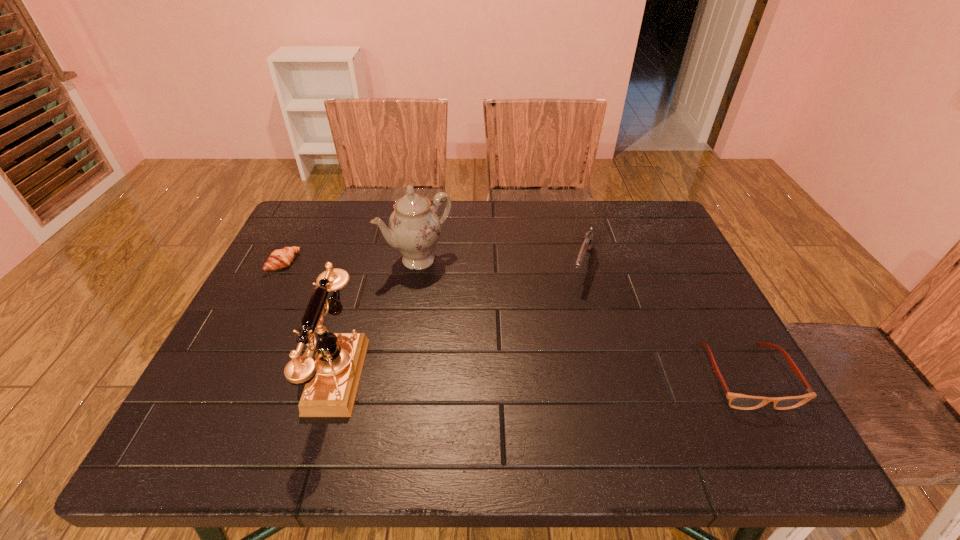
Where is `telephone`? The image size is (960, 540). telephone is located at coordinates pyautogui.click(x=331, y=379).

Where is `the rightmost object`? The image size is (960, 540). the rightmost object is located at coordinates (737, 401).

The height and width of the screenshot is (540, 960). I want to click on the second shortest object, so click(737, 401).

Where is `chinaware`? chinaware is located at coordinates (414, 228).

Locate an element on the screen. Image resolution: width=960 pixels, height=540 pixels. the shortest object is located at coordinates (280, 258).

Identify the location of pastry. (280, 258).

I want to click on the fourth object from left to right, so click(587, 244).

Image resolution: width=960 pixels, height=540 pixels. What are the coordinates of `the third tallest object` in the screenshot? It's located at (587, 244).

At what (x,y) coordinates should I click in order to perform the action: click on vacant space located on the dial of the telephone. Please return your answer as a coordinate pair (x, y). The height and width of the screenshot is (540, 960). Looking at the image, I should click on (233, 374).

You are a GUI agent. You are given a task and a screenshot of the screen. Output one action in this format:
    pyautogui.click(x=<x>, y=<y>)
    Task: Click on the free region located 0.130m on the dial of the telephone
    Image resolution: width=960 pixels, height=540 pixels.
    Given the screenshot: What is the action you would take?
    pyautogui.click(x=243, y=374)